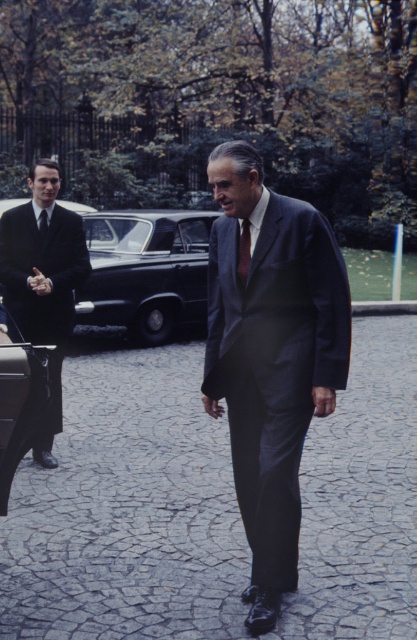
Does dark brown textured tie at center appear on the right side of black silk tie at left?

Indeed, dark brown textured tie at center is positioned on the right side of black silk tie at left.

Does dark brown textured tie at center have a lesser width compared to black silk tie at left?

No, dark brown textured tie at center is not thinner than black silk tie at left.

Is point (243, 282) closer to camera compared to point (42, 216)?

Yes, it is.

Where is `dark brown textured tie at center`? dark brown textured tie at center is located at coordinates (243, 252).

What do you see at coordinates (42, 260) in the screenshot? I see `shiny black suit at left` at bounding box center [42, 260].

Does shiny black suit at left appear on the left side of black leather car at left?

Correct, you'll find shiny black suit at left to the left of black leather car at left.

What are the coordinates of `shiny black suit at left` in the screenshot? It's located at (42, 260).

This screenshot has height=640, width=417. Identify the location of shiny black suit at left. click(42, 260).

Does shiny black car at center have a greater height compared to black leather car at left?

Indeed, shiny black car at center has a greater height compared to black leather car at left.

What are the coordinates of `shiny black car at center` in the screenshot? It's located at (145, 269).

Locate an element on the screen. The image size is (417, 640). shiny black car at center is located at coordinates (145, 269).